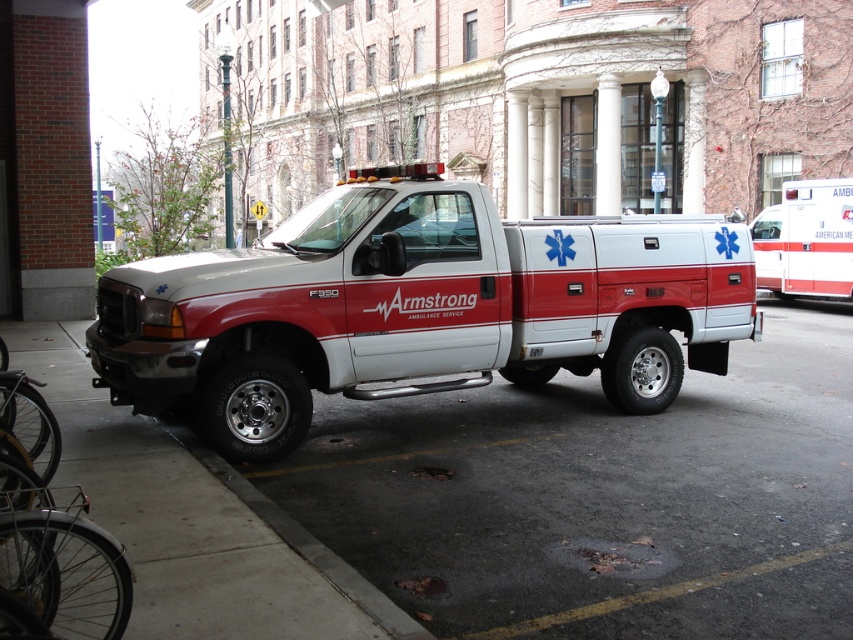
From the picture: You are standing on the sidewalk near the parked ambulance truck and want to walk to the smooth asphalt at center. Which direction should you move in order to reach it?

The smooth asphalt at center is located at point coordinates of (601, 497), so you should move towards the center of the street from the sidewalk where you are currently standing to reach it.

You are a delivery driver who needs to park your truck next to the white matte ambulance at center. The parking spot has a maximum length of 6 meters. Can you safely park your truck there?

The distance between the white matte ambulance at center and the sidewalk is 5.94 meters, which is under the 6 meter limit. Yes, you can safely park your truck there.

You are a pedestrian standing on the sidewalk next to the smooth asphalt at center. You want to cross the street to reach the white glossy ambulance at right. Is the ambulance in front of or behind you?

The smooth asphalt at center is in front of the white glossy ambulance at right, so the ambulance is behind you.